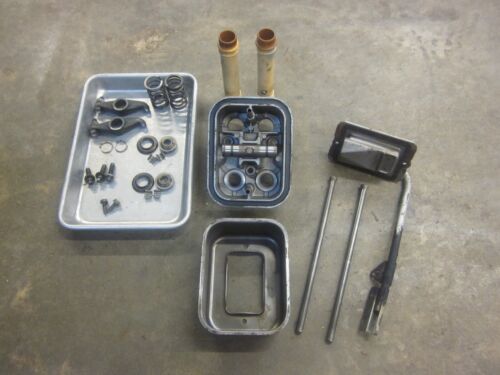
This screenshot has height=375, width=500. I want to click on screw holes, so click(404, 164), click(337, 142).